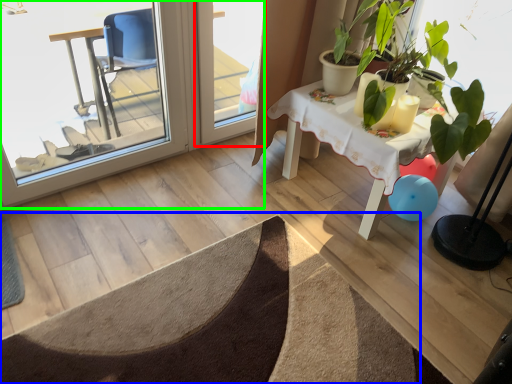
Question: Which is farther away from screen door (highlighted by a red box)? doormat (highlighted by a blue box) or screen door (highlighted by a green box)?

Choices:
 (A) doormat
 (B) screen door

Answer: (A)